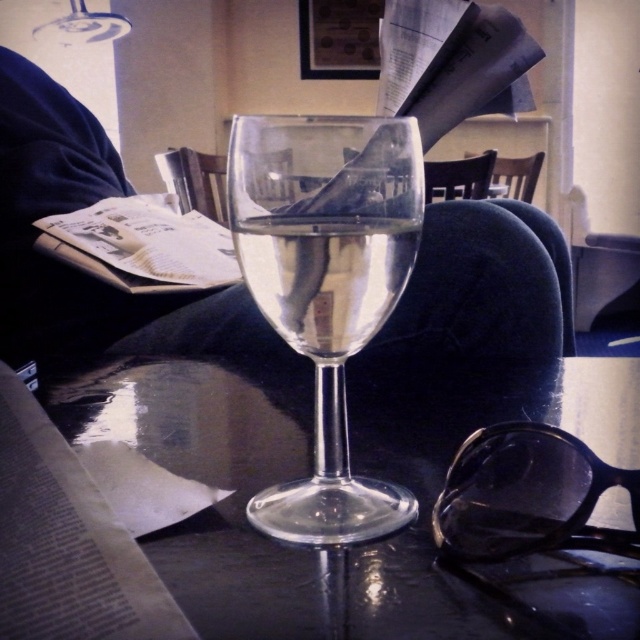
You are a barista at the coffee shop and need to place both the transparent glass table at center and the transparent plastic goggles at lower right on a shelf. The shelf has limited space, and you want to arrange them so that the larger item is placed first. Which object should you place first?

The transparent glass table at center is bigger than the transparent plastic goggles at lower right, so you should place the transparent glass table at center first.

You are trying to place a small decorative item on the transparent glass table at center without it falling off. Considering the clear glass wine at center is already on the table, which object should you be cautious about in terms of space availability?

You should be cautious about the clear glass wine at center because the transparent glass table at center might be wider than it, so there might still be enough space left on the table.

You are standing in the cozy indoor setting and want to place a small vase on the transparent glass table at center. However, there is already a wine glass filled with water on the table. Can you determine if the vase will fit on the table without overlapping the wine glass?

The transparent glass table at center has space for the vase as long as it is placed away from the existing wine glass. The exact positioning would depend on the vase size and the table dimensions not specified here.